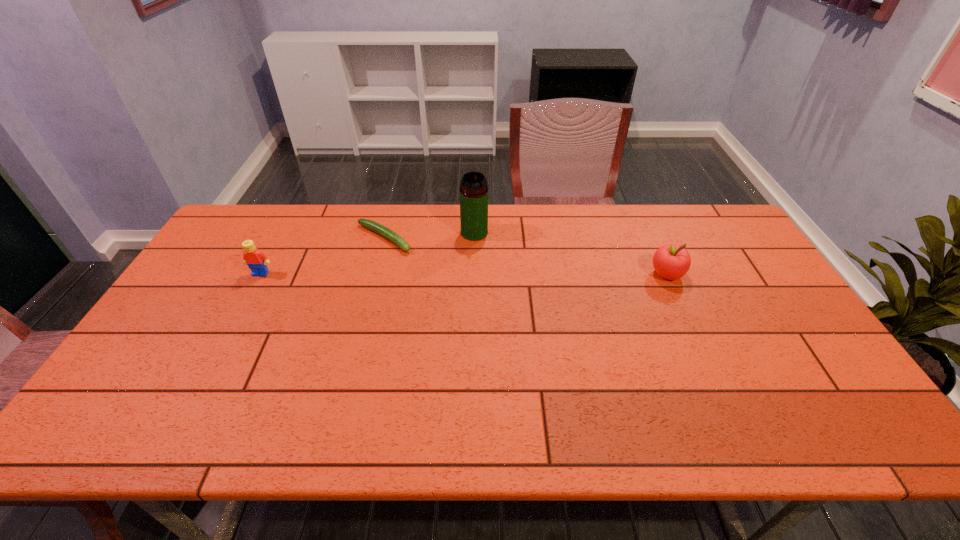
In the image, there is a desktop. What are the coordinates of `vacant region at the near left corner` in the screenshot? It's located at (175, 381).

Where is `vacant area between the shortest object and the apple`? This screenshot has width=960, height=540. vacant area between the shortest object and the apple is located at coordinates (525, 256).

Locate an element on the screen. The image size is (960, 540). vacant area between the tallest object and the apple is located at coordinates (570, 253).

I want to click on free point between the Lego and the zucchini, so click(323, 256).

Where is `vacant space that's between the Lego and the tallest object`? vacant space that's between the Lego and the tallest object is located at coordinates (368, 253).

I want to click on empty space that is in between the rightmost object and the leftmost object, so [x=464, y=274].

The height and width of the screenshot is (540, 960). What are the coordinates of `free spot between the tallest object and the leftmost object` in the screenshot? It's located at (368, 253).

Locate an element on the screen. This screenshot has height=540, width=960. free area in between the leftmost object and the zucchini is located at coordinates (323, 256).

Find the location of `vacant space that is in between the Lego and the tallest object`. vacant space that is in between the Lego and the tallest object is located at coordinates (368, 253).

Identify the location of vacant space that's between the leftmost object and the tallest object. (368, 253).